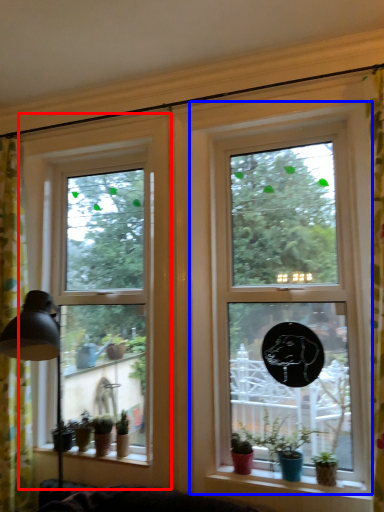
Question: Which point is further to the camera, window (highlighted by a red box) or window (highlighted by a blue box)?

Choices:
 (A) window
 (B) window

Answer: (A)